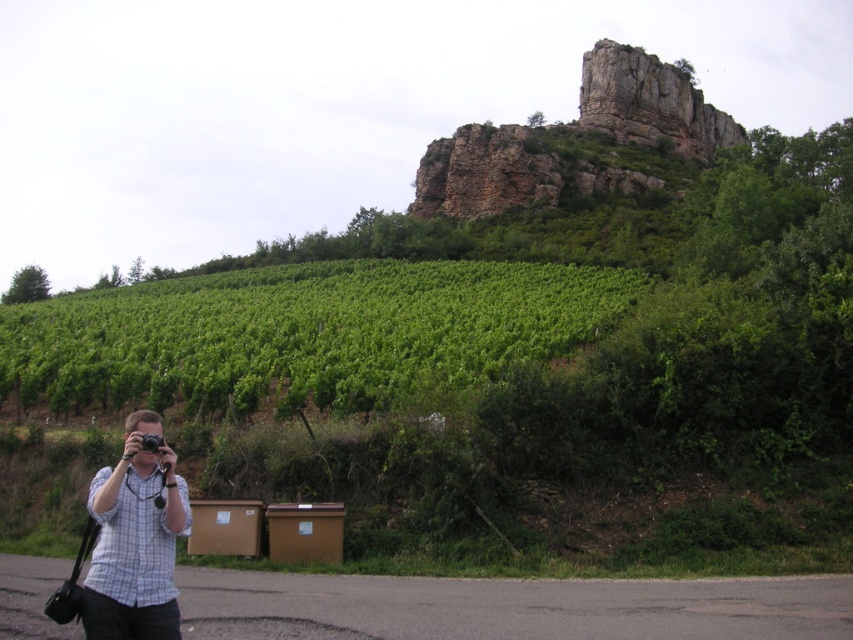
The height and width of the screenshot is (640, 853). What do you see at coordinates (576, 134) in the screenshot?
I see `rusty stone cliff at upper center` at bounding box center [576, 134].

How far apart are rusty stone cliff at upper center and white checkered shirt at lower left?

The distance of rusty stone cliff at upper center from white checkered shirt at lower left is 129.27 meters.

Is point (666, 83) behind point (169, 611)?

Yes, point (666, 83) is behind point (169, 611).

The width and height of the screenshot is (853, 640). Identify the location of rusty stone cliff at upper center. (576, 134).